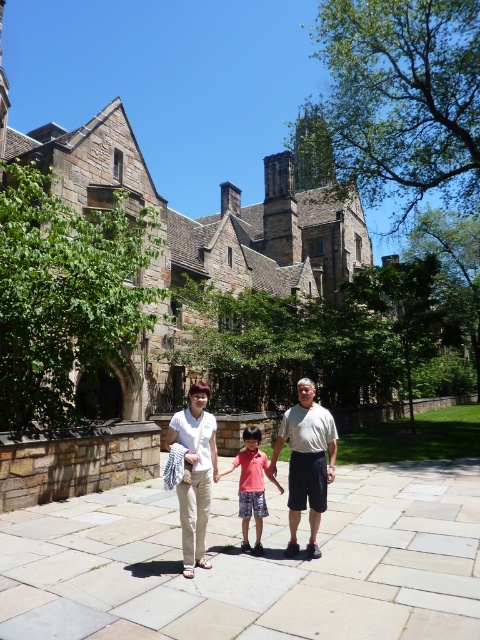
Question: Can you confirm if light beige pants at center is positioned below matte pink shirt at center?

Choices:
 (A) no
 (B) yes

Answer: (A)

Question: Which point is farther to the camera?

Choices:
 (A) matte pink shirt at center
 (B) light beige pants at center

Answer: (A)

Question: In this image, where is white cotton shirt at center located relative to matte white pants at center?

Choices:
 (A) below
 (B) above

Answer: (A)

Question: Which object is farther from the camera taking this photo?

Choices:
 (A) white cotton shirt at center
 (B) matte white pants at center

Answer: (A)

Question: Can you confirm if white cotton shirt at center is positioned to the left of matte pink shirt at center?

Choices:
 (A) no
 (B) yes

Answer: (A)

Question: Which of the following is the closest to the observer?

Choices:
 (A) (205, 524)
 (B) (321, 428)
 (C) (310, 394)
 (D) (252, 492)

Answer: (A)